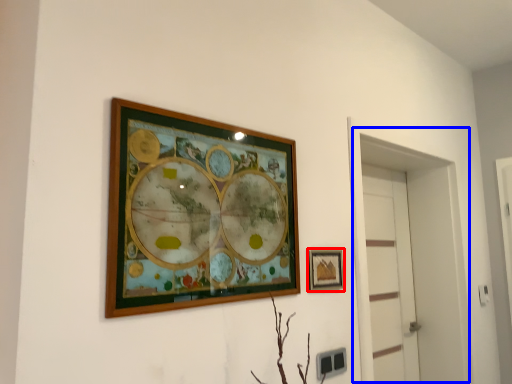
Question: Which object is closer to the camera taking this photo, picture frame (highlighted by a red box) or glass door (highlighted by a blue box)?

Choices:
 (A) picture frame
 (B) glass door

Answer: (A)